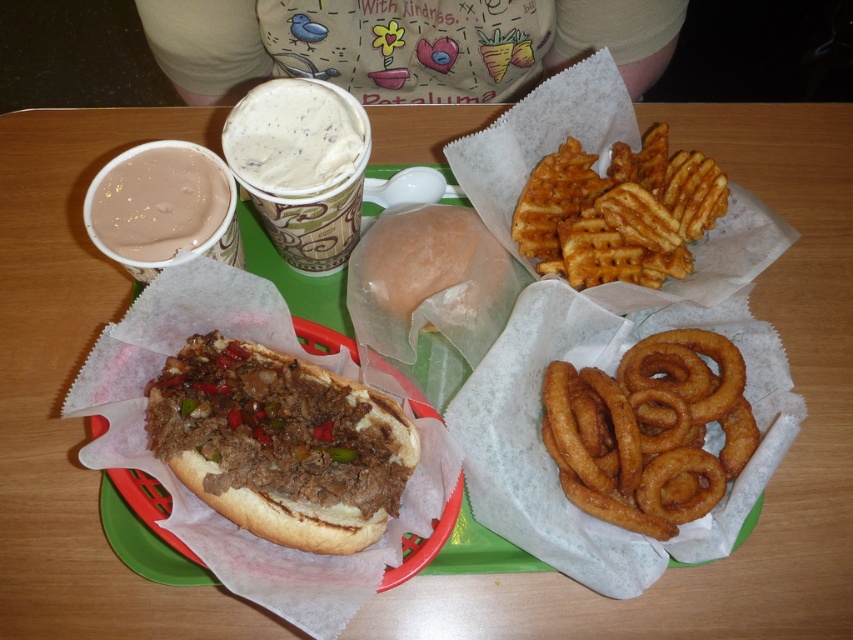
You are a food delivery person who needs to stack these items in a box. The brown breaded meat at lower left and the light brown creamy cup at center must be placed one on top of the other. Which item should be placed at the bottom to prevent the top item from crushing it?

The brown breaded meat at lower left should be placed at the bottom because it has a greater height compared to the light brown creamy cup at center, making it more sturdy to support the weight.

You are holding a fork and want to reach the point at coordinates point [349,120] on the green tray. The tray is 18 inches wide. Can you reach that point without moving the tray?

The point [349,120] is 21.29 inches away from the viewer, which is beyond the tray width of 18 inches. Therefore, you cannot reach it without moving the tray.

You are at a diner and want to order a drink. You see the light brown creamy cup at center and the smooth chocolate milkshake at upper left on the table. Which drink is positioned to the right of the other?

The light brown creamy cup at center is to the right of the smooth chocolate milkshake at upper left.